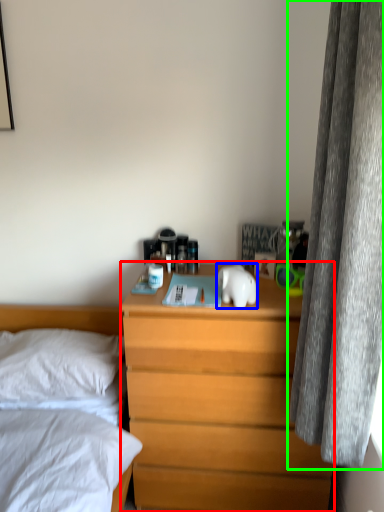
Question: Estimate the real-world distances between objects in this image. Which object is closer to nightstand (highlighted by a red box), animal (highlighted by a blue box) or curtain (highlighted by a green box)?

Choices:
 (A) animal
 (B) curtain

Answer: (A)